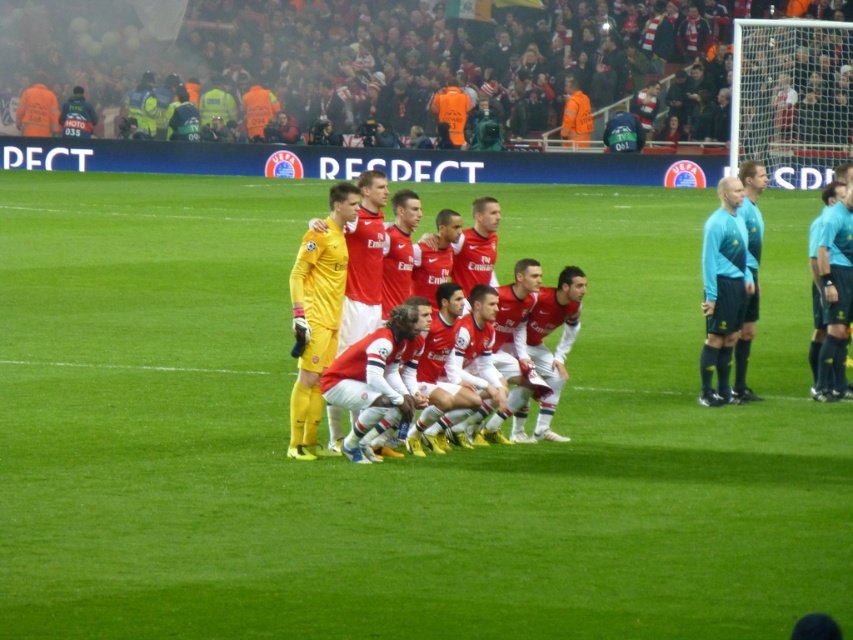
Which is more to the right, light blue jersey at right or light blue jersey at center?

From the viewer's perspective, light blue jersey at center appears more on the right side.

Which is in front, point (741, 298) or point (743, 349)?

Point (741, 298) is more forward.

Where is `light blue jersey at right`? This screenshot has width=853, height=640. light blue jersey at right is located at coordinates (722, 291).

Who is more distant from viewer, (444, 228) or (758, 237)?

Point (758, 237)

Which is more to the left, matte red jersey at center or light blue jersey at center?

matte red jersey at center

The width and height of the screenshot is (853, 640). Find the location of `matte red jersey at center`. matte red jersey at center is located at coordinates (375, 256).

Between green grass football field at center and light blue jersey at right, which one has more height?

green grass football field at center

Which is more to the left, green grass football field at center or light blue jersey at right?

green grass football field at center is more to the left.

Does point (820, 444) lie in front of point (724, 387)?

Yes, it is in front of point (724, 387).

I want to click on green grass football field at center, so click(x=399, y=458).